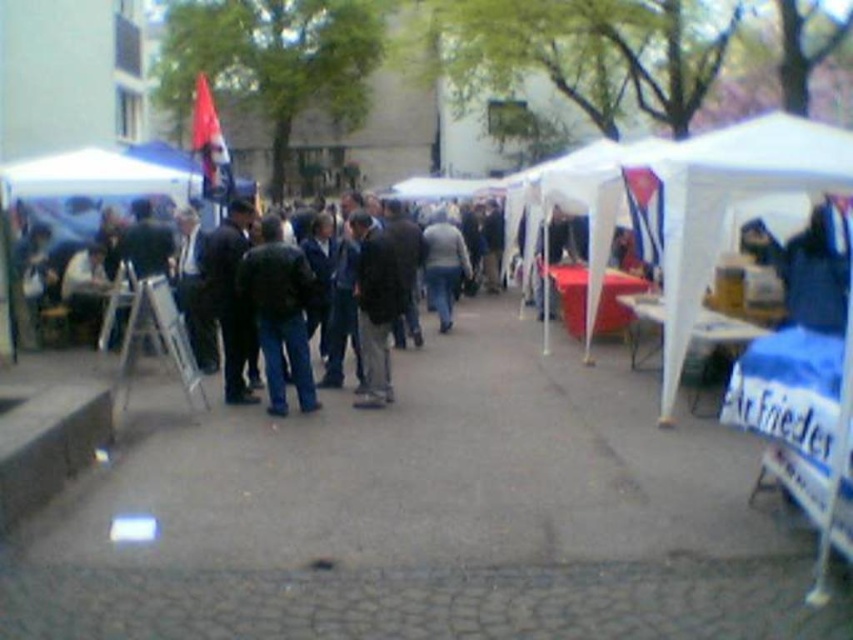
You are standing at the entrance of the outdoor market and see two points marked on the ground. The first point is at coordinate point(828, 184) and the second point is at coordinate point(276, 282). Which point is closer to you?

Point(828, 184) is closer to the viewer than point(276, 282).

You are a customer at the outdoor market and want to try on both the dark blue jacket at center and the gray sweater at center. Which one do you think will require more space in your bag when you carry them?

The dark blue jacket at center has a larger size compared to gray sweater at center, so it will require more space in your bag when you carry them.

You are standing at the entrance of the outdoor market and see two points marked in the scene. One is at point (277, 250) and the other at point (438, 307). Which point is closer to you as you face the market?

→ Point (277, 250) is in front of point (438, 307), so it is closer to you as you face the market.